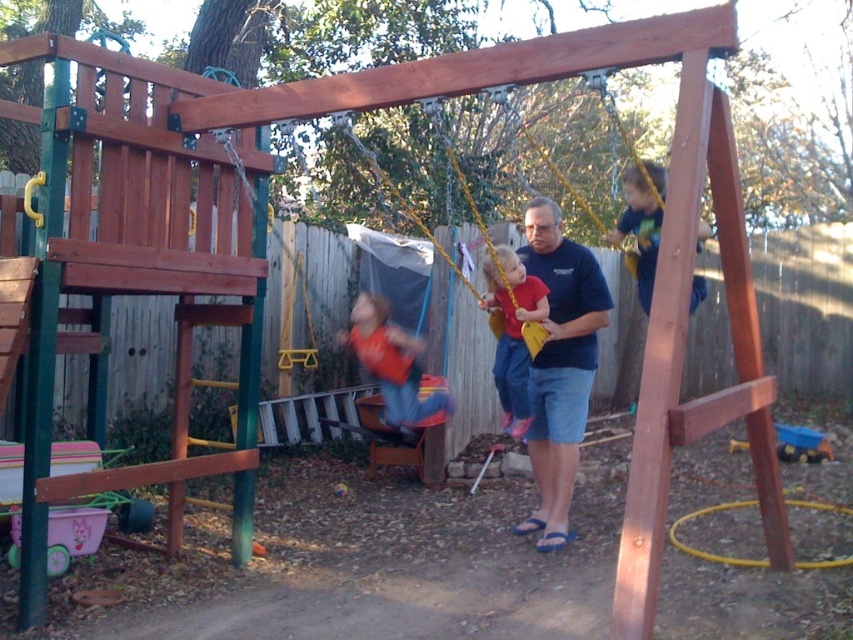
Looking at this image, you are standing in the backyard and want to place a new flower pot between the two points marked as point (405, 392) and point (531, 323). Which point should the flower pot be closer to in order to be closer to you?

The flower pot should be closer to point (405, 392) because it is nearer to you compared to point (531, 323).